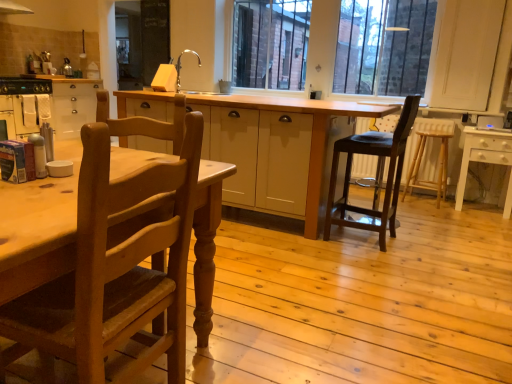
Find the location of `free space underneath light brown wooden bar stool at right (from a real-world perspective)`. free space underneath light brown wooden bar stool at right (from a real-world perspective) is located at coordinates (420, 201).